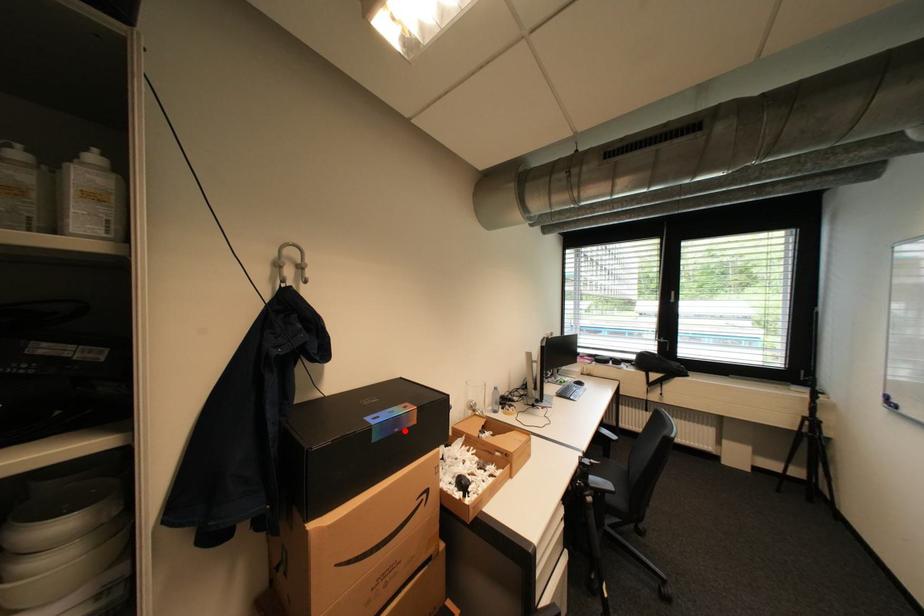
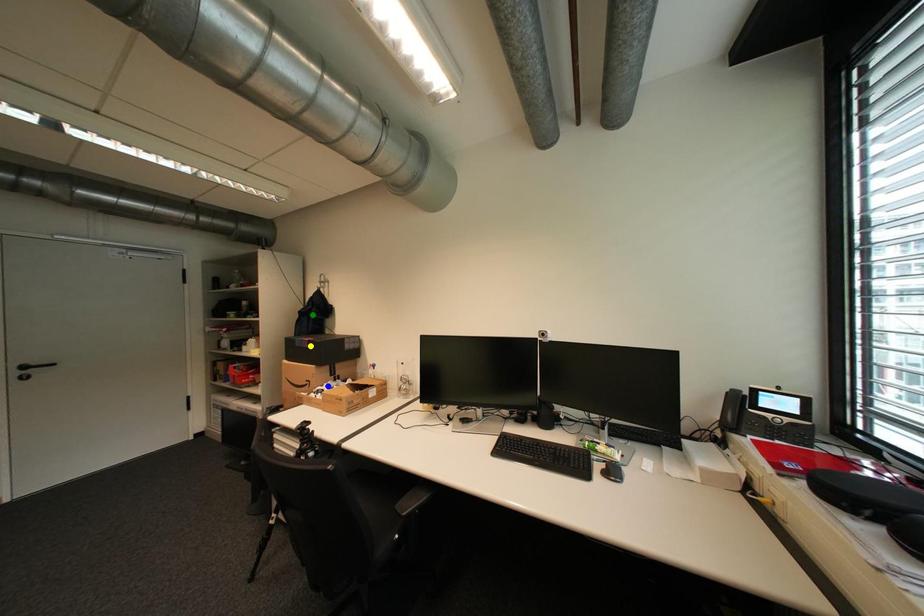
Question: I am providing you with two images of the same scene from different viewpoints. A red point is marked on the first image. You are given multiple points on the second image. Which point in image 2 is actually the same real-world point as the red point in image 1?

Choices:
 (A) blue point
 (B) green point
 (C) yellow point

Answer: (C)